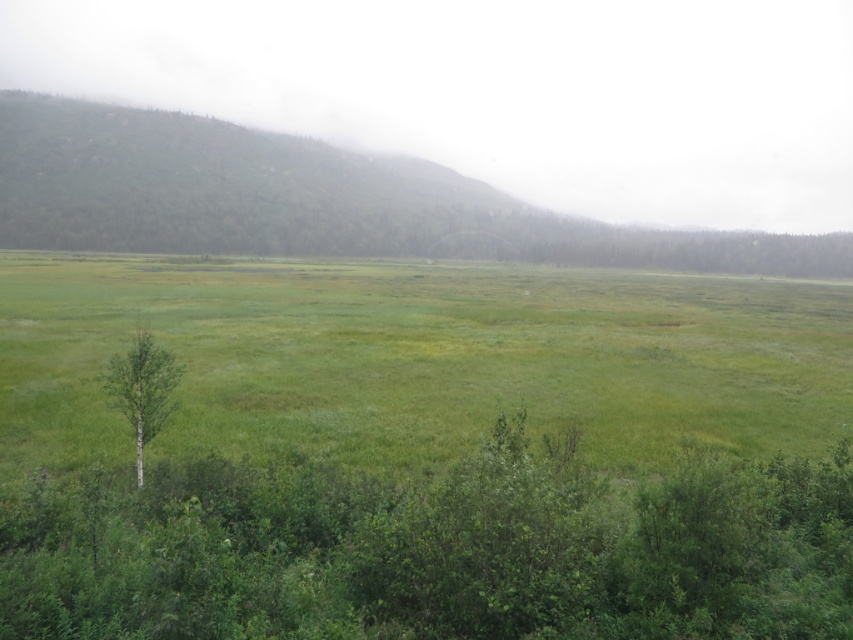
In the scene shown: Who is lower down, green leafy tree at lower left or green matte tree at left?

green leafy tree at lower left is lower down.

Between green leafy tree at lower left and green matte tree at left, which one has more height?

green matte tree at left is taller.

At what (x,y) coordinates should I click in order to perform the action: click on green leafy tree at lower left. Please return your answer as a coordinate pair (x, y). The image size is (853, 640). Looking at the image, I should click on [433, 548].

The width and height of the screenshot is (853, 640). Find the location of `green leafy tree at lower left`. green leafy tree at lower left is located at coordinates (433, 548).